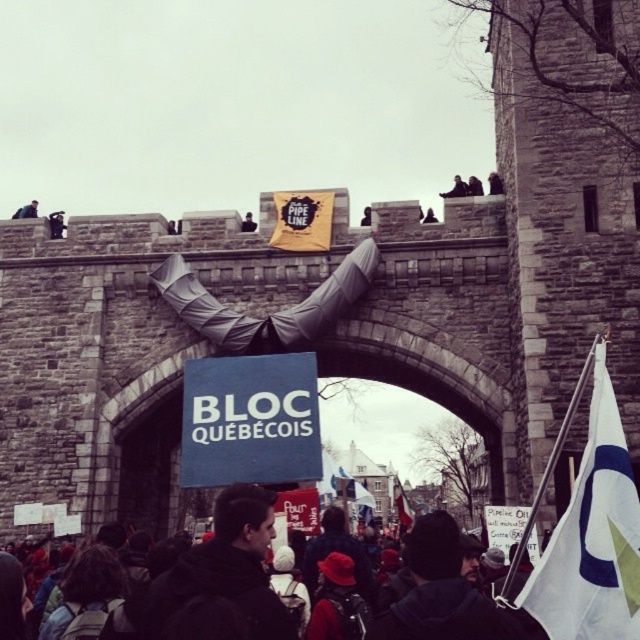
Which is in front, point (316, 227) or point (244, 225)?

Point (316, 227)

The height and width of the screenshot is (640, 640). What do you see at coordinates (301, 220) in the screenshot? I see `yellow fabric banner at upper center` at bounding box center [301, 220].

The height and width of the screenshot is (640, 640). I want to click on yellow fabric banner at upper center, so click(301, 220).

In the scene shown: Between black fabric jacket at lower center and dark gray fabric at center, which one has less height?

dark gray fabric at center is shorter.

Is black fabric jacket at lower center positioned behind dark gray fabric at center?

No, black fabric jacket at lower center is closer to the viewer.

In order to click on black fabric jacket at lower center in this screenshot , I will do `click(224, 572)`.

Locate an element on the screen. Image resolution: width=640 pixels, height=640 pixels. black fabric jacket at lower center is located at coordinates tap(224, 572).

Is point (404, 496) closer to viewer compared to point (448, 193)?

No, it is not.

Who is lower down, white fabric flag at center or dark gray fabric at upper center?

white fabric flag at center

Locate an element on the screen. The image size is (640, 640). white fabric flag at center is located at coordinates (401, 506).

This screenshot has width=640, height=640. Find the location of `white fabric flag at center`. white fabric flag at center is located at coordinates (401, 506).